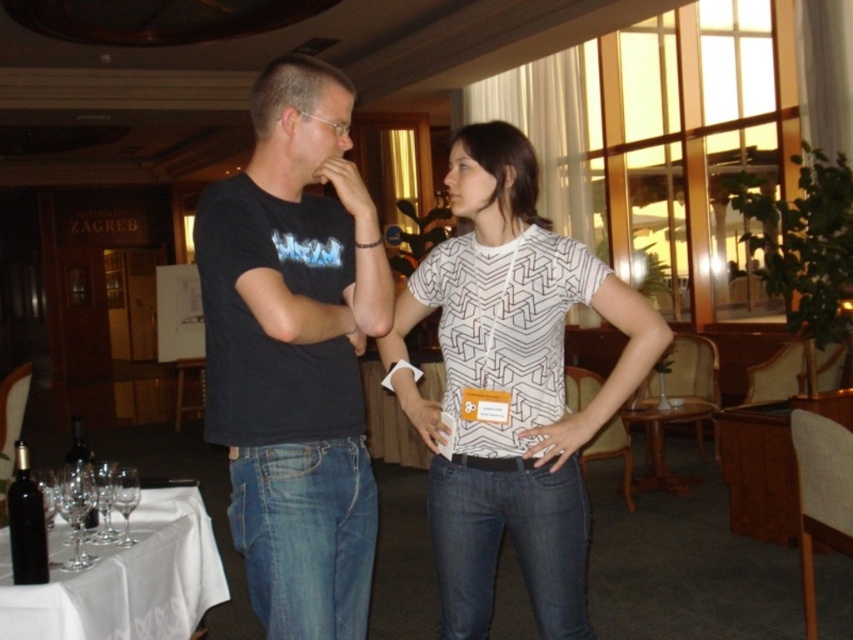
Question: Is black matte t-shirt at center above white geometric shirt at center?

Choices:
 (A) yes
 (B) no

Answer: (A)

Question: Considering the relative positions of black matte t-shirt at center and white geometric shirt at center in the image provided, where is black matte t-shirt at center located with respect to white geometric shirt at center?

Choices:
 (A) above
 (B) below

Answer: (A)

Question: From the image, what is the correct spatial relationship of black matte t-shirt at center in relation to white geometric shirt at center?

Choices:
 (A) right
 (B) left

Answer: (B)

Question: Among these points, which one is farthest from the camera?

Choices:
 (A) (432, 508)
 (B) (340, 458)

Answer: (A)